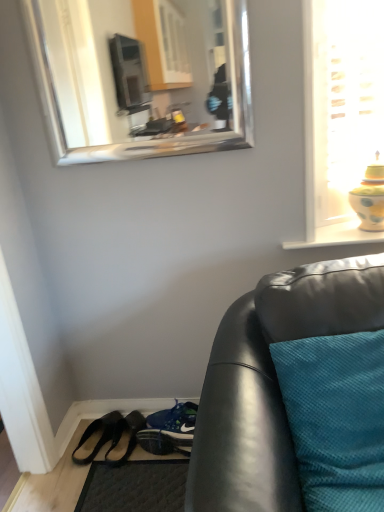
The width and height of the screenshot is (384, 512). In order to click on vacant point above dark gray textured mat at lower left (from a real-world perspective) in this screenshot , I will do `click(140, 481)`.